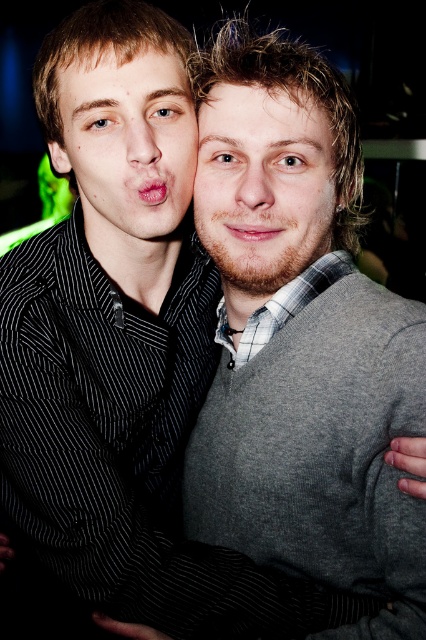
Between point (270, 173) and point (152, 186), which one is positioned in front?

Point (270, 173)

Is point (241, 188) farther from camera compared to point (164, 184)?

No.

At what (x,y) coordinates should I click in order to perform the action: click on smooth skin nose at center. Please return your answer as a coordinate pair (x, y). This screenshot has height=640, width=426. Looking at the image, I should click on (253, 182).

Can you confirm if matte black shirt at left is smaller than smooth skin nose at center?

Incorrect, matte black shirt at left is not smaller in size than smooth skin nose at center.

Which is in front, point (169, 76) or point (325, 193)?

Positioned in front is point (169, 76).

This screenshot has width=426, height=640. In order to click on matte black shirt at left in this screenshot , I will do `click(126, 144)`.

Is point (103, 113) farther from camera compared to point (259, 218)?

No, it is in front of (259, 218).

Does matte black shirt at left have a greater width compared to brown matte beard at center?

Yes, matte black shirt at left is wider than brown matte beard at center.

Find the location of a particular element. matte black shirt at left is located at coordinates (126, 144).